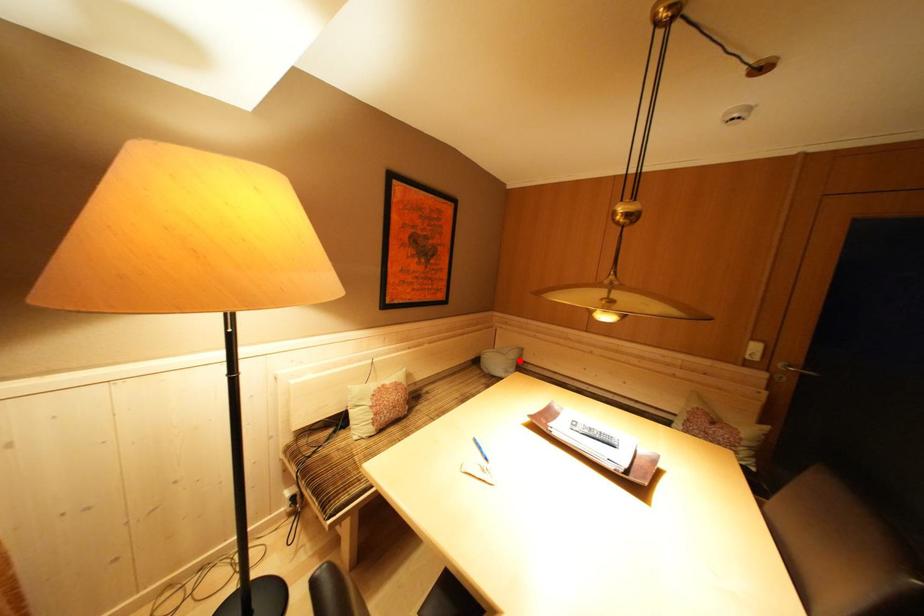
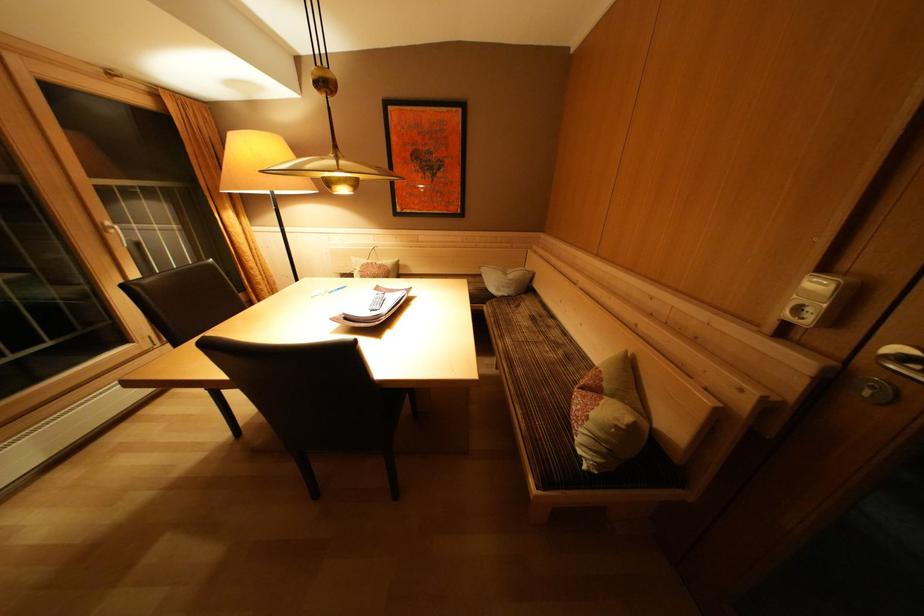
In the second image, find the point that corresponds to the highlighted location in the first image.

(517, 281)